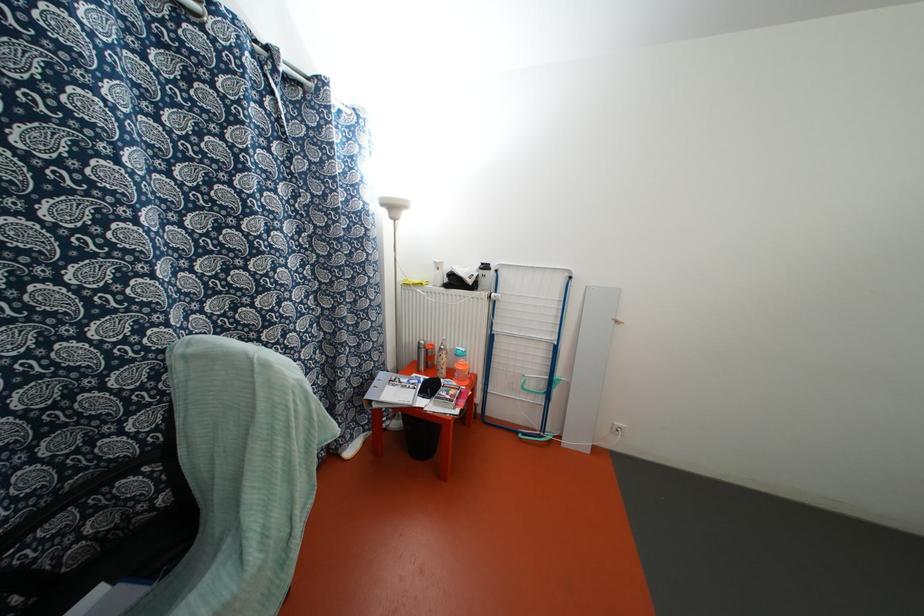
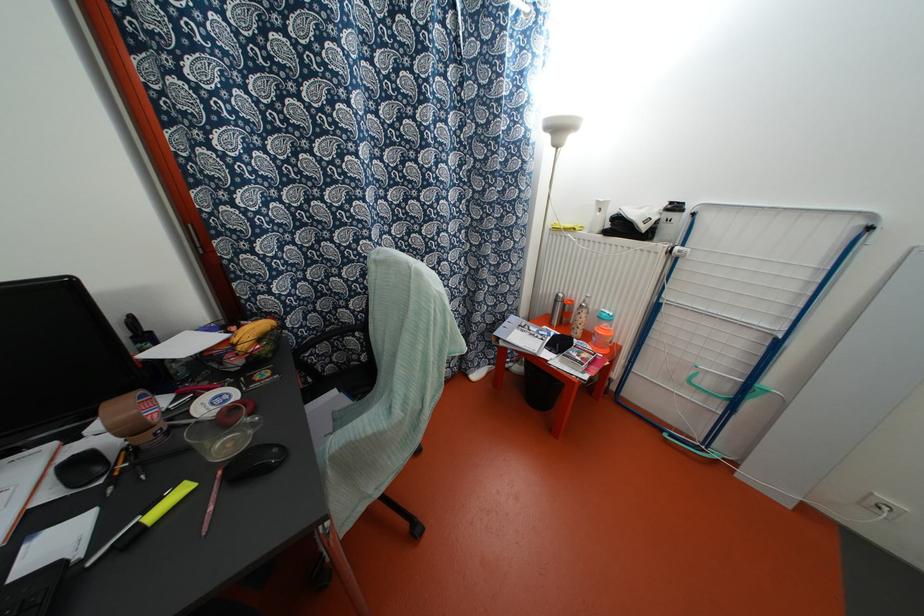
Where in the second image is the point corresponding to the point at 440,283 from the first image?

(599, 228)